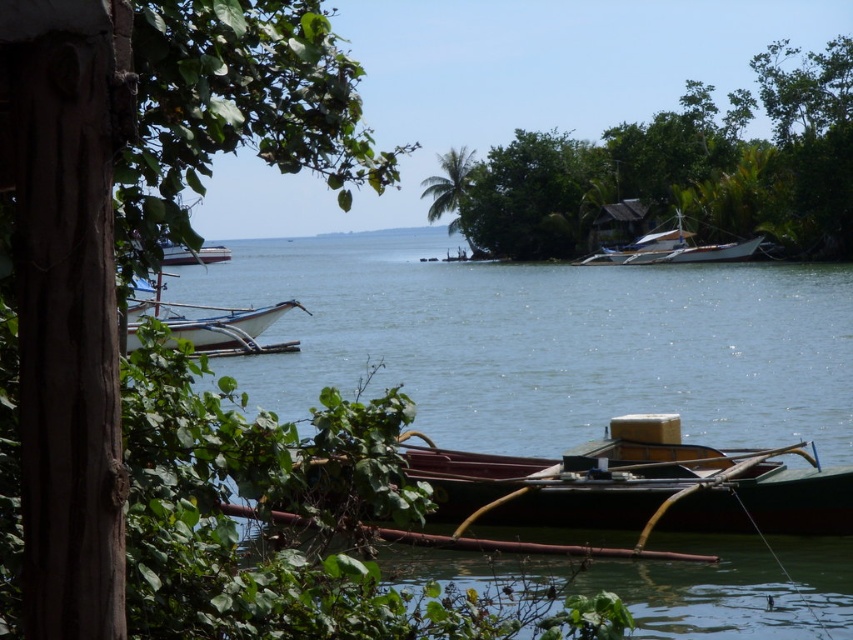
You are a photographer standing at the shoreline. You want to capture a photo that includes both the white wooden boat at center and the green leafy palm tree at center. Based on their sizes, which object will appear larger in your photo?

The green leafy palm tree at center will appear larger in the photo because it is bigger than the white wooden boat at center.

You are a photographer standing at the shoreline and want to capture a photo of the white wooden boat at left without the green leafy tree at upper left blocking the view. Can you adjust your position to do so?

The green leafy tree at upper left is taller than the white wooden boat at left, so moving to a lower position or angling the camera downward might help avoid the tree blocking the boat.